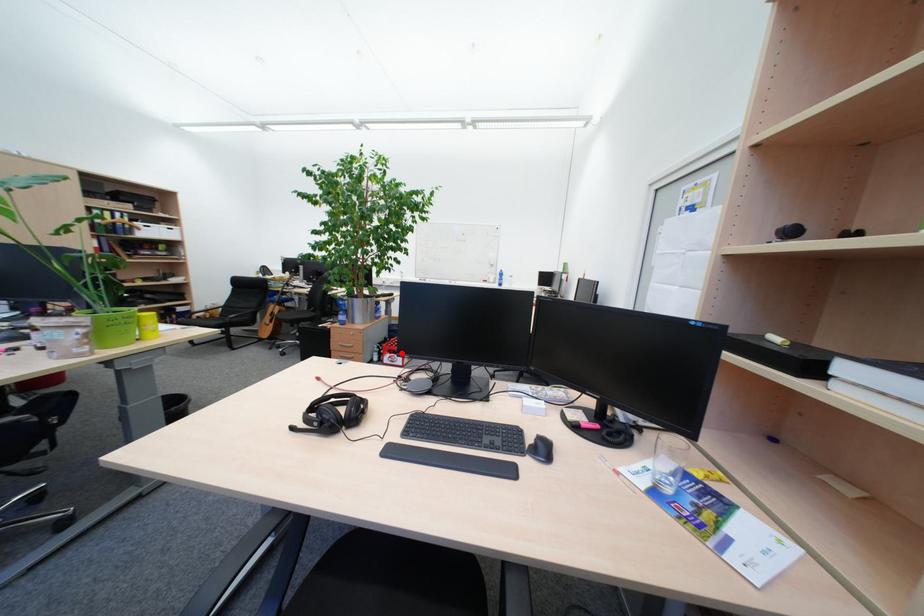
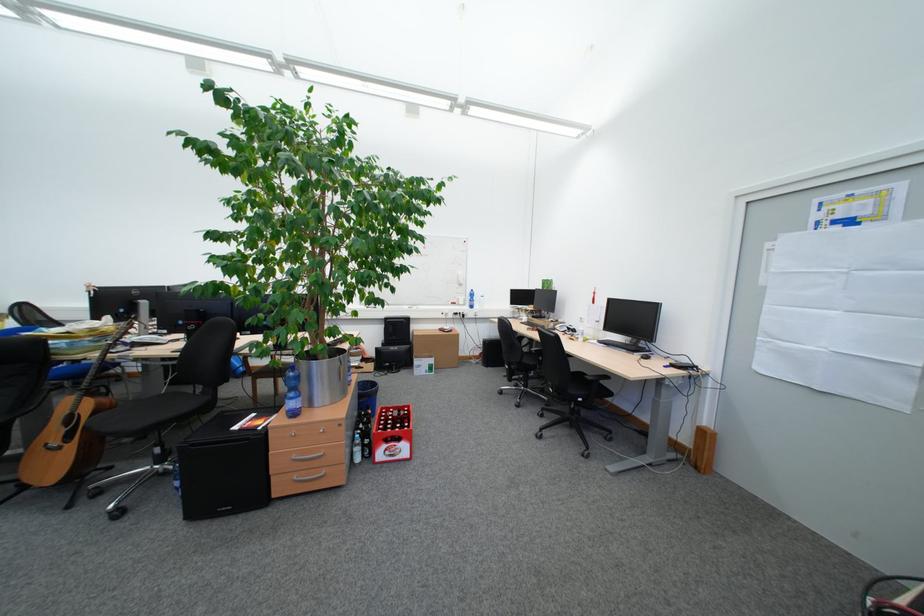
Where in the second image is the point corresponding to the highlighted location from the first image?

(398, 442)